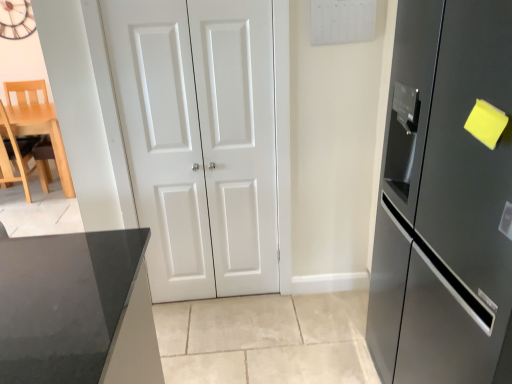
Where is `satin black refrigerator at right`? The height and width of the screenshot is (384, 512). satin black refrigerator at right is located at coordinates (445, 200).

What is the approximate width of white matte door at center, positioned as the first door in right-to-left order?

It is 2.06 inches.

Locate an element on the screen. white matte door at center, which is the 2th door in left-to-right order is located at coordinates (238, 139).

Locate an element on the screen. This screenshot has width=512, height=384. satin black refrigerator at right is located at coordinates (445, 200).

Looking at this image, which object is wider, wooden clock at upper left or white matte door at center, which is the 2th door in left-to-right order?

With larger width is wooden clock at upper left.

Which point is more distant from viewer, (7, 14) or (234, 77)?

The point (7, 14) is behind.

Are wooden clock at upper left and white matte door at center, which is the 2th door in left-to-right order, located far from each other?

Yes, wooden clock at upper left and white matte door at center, which is the 2th door in left-to-right order, are quite far apart.

Between white matte door at center, positioned as the first door in right-to-left order, and satin black refrigerator at right, which one has more height?

With more height is white matte door at center, positioned as the first door in right-to-left order.

From a real-world perspective, is white matte door at center, positioned as the first door in right-to-left order, physically above satin black refrigerator at right?

Yes, from a real-world perspective, white matte door at center, positioned as the first door in right-to-left order, is on top of satin black refrigerator at right.

In the scene shown: Is white matte door at center, positioned as the first door in right-to-left order, smaller than satin black refrigerator at right?

Yes, white matte door at center, positioned as the first door in right-to-left order, is smaller than satin black refrigerator at right.

Is point (444, 231) farther from viewer compared to point (11, 133)?

No, (444, 231) is closer to viewer.

Consider the image. Is satin black refrigerator at right positioned beyond the bounds of light wood chair at left?

Yes.

Considering the relative sizes of satin black refrigerator at right and light wood chair at left in the image provided, is satin black refrigerator at right thinner than light wood chair at left?

No, satin black refrigerator at right is not thinner than light wood chair at left.

From the image's perspective, is satin black refrigerator at right above or below light wood chair at left?

From the image's perspective, satin black refrigerator at right appears below light wood chair at left.

From the image's perspective, who appears lower, light wood chair at left or white matte door at center, placed as the second door when sorted from right to left?

white matte door at center, placed as the second door when sorted from right to left.

Can you confirm if light wood chair at left is positioned to the left of white matte door at center, placed as the second door when sorted from right to left?

Yes.

Is light wood chair at left behind white matte door at center, placed as the second door when sorted from right to left?

Yes, light wood chair at left is further from the viewer.

Is light wood chair at left beside white matte door at center, positioned as the 1th door in left-to-right order?

light wood chair at left is not next to white matte door at center, positioned as the 1th door in left-to-right order, and they're not touching.

Between point (232, 28) and point (19, 160), which one is positioned behind?

Point (19, 160)

Looking at their sizes, would you say white matte door at center, positioned as the first door in right-to-left order, is wider or thinner than light wood chair at left?

Clearly, white matte door at center, positioned as the first door in right-to-left order, has less width compared to light wood chair at left.

From the image's perspective, which object appears higher, white matte door at center, which is the 2th door in left-to-right order, or light wood chair at left?

light wood chair at left, from the image's perspective.

Consider the image. Does white matte door at center, which is the 2th door in left-to-right order, turn towards light wood chair at left?

No, white matte door at center, which is the 2th door in left-to-right order, does not turn towards light wood chair at left.

Does white matte door at center, which is the 2th door in left-to-right order, turn towards wooden clock at upper left?

No, white matte door at center, which is the 2th door in left-to-right order, is not aimed at wooden clock at upper left.

Considering the points (218, 273) and (6, 18), which point is in front, point (218, 273) or point (6, 18)?

The point (218, 273) is in front.

Is white matte door at center, which is the 2th door in left-to-right order, positioned before wooden clock at upper left?

Yes, white matte door at center, which is the 2th door in left-to-right order, is closer to the camera.

Is white matte door at center, which is the 2th door in left-to-right order, situated inside wooden clock at upper left or outside?

white matte door at center, which is the 2th door in left-to-right order, exists outside the volume of wooden clock at upper left.

Is white matte door at center, positioned as the 1th door in left-to-right order, taller or shorter than wooden clock at upper left?

In the image, white matte door at center, positioned as the 1th door in left-to-right order, appears to be taller than wooden clock at upper left.

Does white matte door at center, positioned as the 1th door in left-to-right order, have a lesser width compared to wooden clock at upper left?

Incorrect, the width of white matte door at center, positioned as the 1th door in left-to-right order, is not less than that of wooden clock at upper left.

In the image, is white matte door at center, placed as the second door when sorted from right to left, on the left side or the right side of wooden clock at upper left?

white matte door at center, placed as the second door when sorted from right to left, is positioned on wooden clock at upper left's right side.

From a real-world perspective, starting from the wooden clock at upper left, which door is the 1st one below it? Please provide its 2D coordinates.

[(238, 139)]

The width and height of the screenshot is (512, 384). I want to click on refrigerator on the right of white matte door at center, positioned as the first door in right-to-left order, so click(x=445, y=200).

Estimate the real-world distances between objects in this image. Which object is further from white matte door at center, which is the 2th door in left-to-right order, white matte door at center, placed as the second door when sorted from right to left, or satin black refrigerator at right?

The object further to white matte door at center, which is the 2th door in left-to-right order, is satin black refrigerator at right.

Considering their positions, is wooden clock at upper left positioned closer to light wood chair at left than satin black refrigerator at right?

The object closer to light wood chair at left is wooden clock at upper left.

From the image, which object appears to be nearer to satin black refrigerator at right, white matte door at center, positioned as the 1th door in left-to-right order, or light wood chair at left?

white matte door at center, positioned as the 1th door in left-to-right order, is positioned closer to the anchor satin black refrigerator at right.

Looking at the image, which one is located closer to satin black refrigerator at right, white matte door at center, placed as the second door when sorted from right to left, or white matte door at center, which is the 2th door in left-to-right order?

Among the two, white matte door at center, which is the 2th door in left-to-right order, is located nearer to satin black refrigerator at right.

From the image, which object appears to be nearer to satin black refrigerator at right, white matte door at center, positioned as the first door in right-to-left order, or light wood chair at left?

Based on the image, white matte door at center, positioned as the first door in right-to-left order, appears to be nearer to satin black refrigerator at right.

In the scene shown: Estimate the real-world distances between objects in this image. Which object is closer to white matte door at center, positioned as the 1th door in left-to-right order, wooden clock at upper left or satin black refrigerator at right?

The object closer to white matte door at center, positioned as the 1th door in left-to-right order, is satin black refrigerator at right.

Based on their spatial positions, is white matte door at center, positioned as the 1th door in left-to-right order, or wooden clock at upper left closer to white matte door at center, positioned as the first door in right-to-left order?

Among the two, white matte door at center, positioned as the 1th door in left-to-right order, is located nearer to white matte door at center, positioned as the first door in right-to-left order.

Looking at the image, which one is located further to wooden clock at upper left, satin black refrigerator at right or white matte door at center, which is the 2th door in left-to-right order?

satin black refrigerator at right is positioned further to the anchor wooden clock at upper left.

This screenshot has height=384, width=512. I want to click on chair positioned between satin black refrigerator at right and wooden clock at upper left from near to far, so click(x=15, y=155).

The image size is (512, 384). What are the coordinates of `door between satin black refrigerator at right and white matte door at center, which is the 2th door in left-to-right order, from front to back` in the screenshot? It's located at (201, 140).

Locate an element on the screen. The height and width of the screenshot is (384, 512). chair between white matte door at center, positioned as the 1th door in left-to-right order, and wooden clock at upper left from front to back is located at coordinates (15, 155).

Image resolution: width=512 pixels, height=384 pixels. What are the coordinates of `door between white matte door at center, positioned as the 1th door in left-to-right order, and wooden clock at upper left, along the z-axis` in the screenshot? It's located at (238, 139).